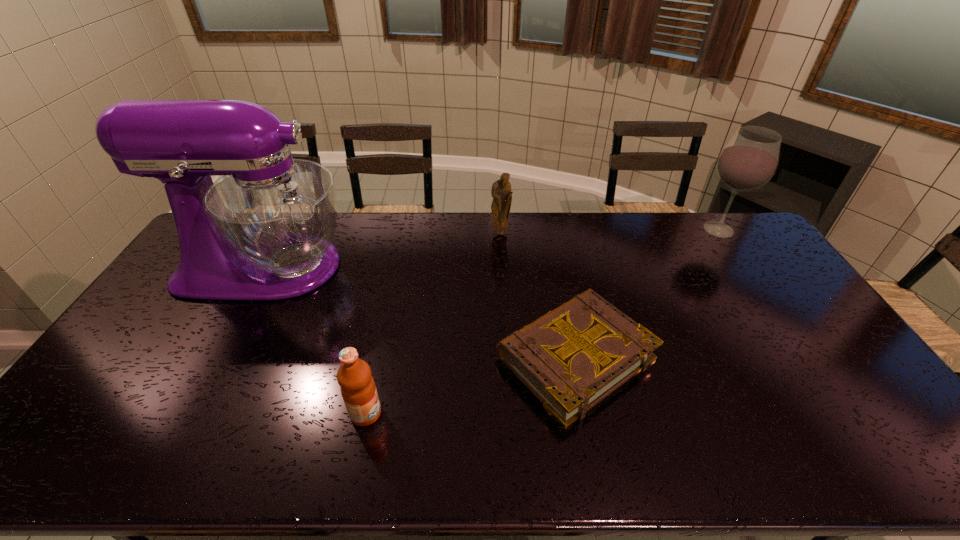
Where is `blank space located 0.070m on the front label of the fruit juice`? blank space located 0.070m on the front label of the fruit juice is located at coordinates point(410,413).

You are a GUI agent. You are given a task and a screenshot of the screen. Output one action in this format:
    pyautogui.click(x=<x>, y=<y>)
    Task: Click on the vacant space located on the left of the shortest object
    This screenshot has height=540, width=960.
    Given the screenshot: What is the action you would take?
    pyautogui.click(x=367, y=357)

You are a GUI agent. You are given a task and a screenshot of the screen. Output one action in this format:
    pyautogui.click(x=<x>, y=<y>)
    Task: Click on the mixer present at the far edge
    The width and height of the screenshot is (960, 540).
    Given the screenshot: What is the action you would take?
    pyautogui.click(x=264, y=231)

Locate an element on the screen. alcohol that is at the far edge is located at coordinates (749, 160).

You are a GUI agent. You are given a task and a screenshot of the screen. Output one action in this format:
    pyautogui.click(x=<x>, y=<y>)
    Task: Click on the figurine at the far edge
    
    Given the screenshot: What is the action you would take?
    pyautogui.click(x=501, y=192)

Find the location of a particular element. This screenshot has width=960, height=540. object situated at the left edge is located at coordinates (264, 231).

Find the location of a particular element. Image resolution: width=960 pixels, height=540 pixels. object that is positioned at the right edge is located at coordinates (749, 160).

Where is `object that is at the far left corner`? object that is at the far left corner is located at coordinates (264, 231).

This screenshot has width=960, height=540. Find the location of `object that is at the far right corner`. object that is at the far right corner is located at coordinates (749, 160).

Identify the location of vacant space at the far edge of the desktop. (538, 214).